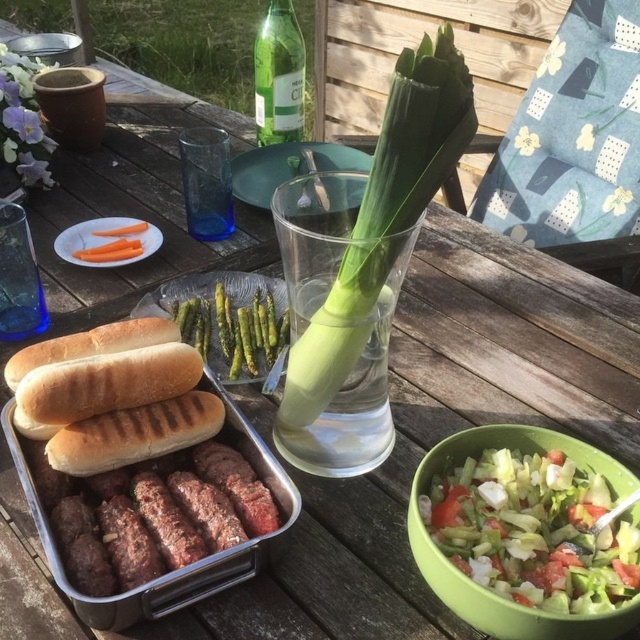
Question: Which of the following is the farthest from the observer?

Choices:
 (A) orange matte carrots at center
 (B) brown toasted bread at center
 (C) transparent glass at center

Answer: (C)

Question: Does brown toasted bread at center appear over orange matte carrots at center?

Choices:
 (A) no
 (B) yes

Answer: (A)

Question: Which point is closer to the camera?

Choices:
 (A) 154,248
 (B) 68,413
 (C) 609,540
 (D) 316,417

Answer: (C)

Question: Which of the following is the farthest from the observer?

Choices:
 (A) fresh green salad at lower right
 (B) transparent glass at center
 (C) brown toasted bread at center

Answer: (B)

Question: Can you confirm if green leafy vegetable at center is thinner than transparent glass at center?

Choices:
 (A) yes
 (B) no

Answer: (A)

Question: Considering the relative positions of green leafy vegetable at center and green glass bottle at upper center in the image provided, where is green leafy vegetable at center located with respect to green glass bottle at upper center?

Choices:
 (A) below
 (B) above

Answer: (A)